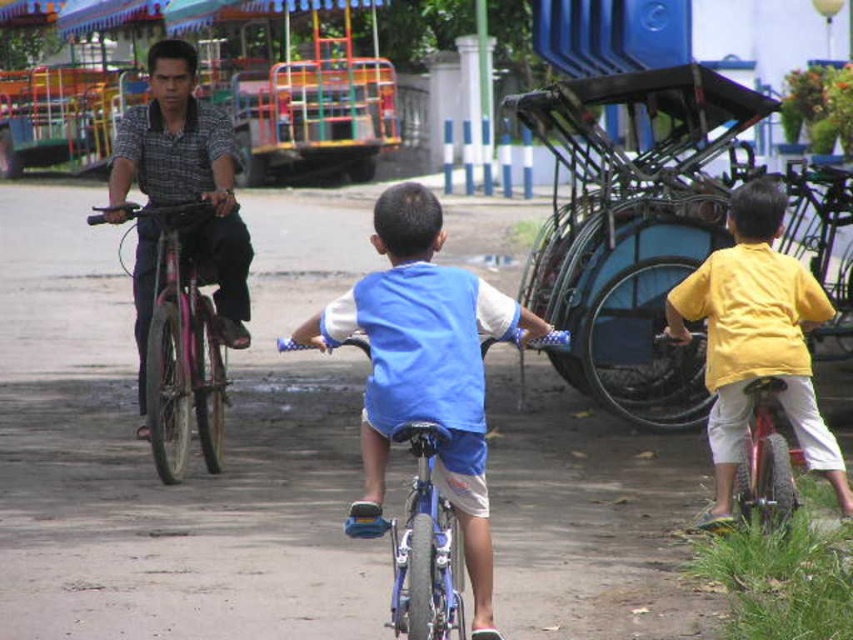
Question: Which point is farther to the camera?

Choices:
 (A) pink matte bicycle at left
 (B) yellow matte shirt at right

Answer: (A)

Question: Can you confirm if metallic blue tricycle at right is positioned to the left of blue fabric shirt at center?

Choices:
 (A) no
 (B) yes

Answer: (A)

Question: Which of the following is the closest to the observer?

Choices:
 (A) matte black shirt at left
 (B) metallic blue tricycle at right
 (C) blue fabric shirt at center
 (D) pink matte bicycle at left

Answer: (C)

Question: Does blue fabric shirt at center appear on the right side of pink matte bicycle at left?

Choices:
 (A) no
 (B) yes

Answer: (B)

Question: Which object is positioned closest to the metallic blue tricycle at right?

Choices:
 (A) yellow matte shirt at right
 (B) matte black shirt at left
 (C) pink matte bicycle at left
 (D) blue fabric shirt at center

Answer: (A)

Question: Can you confirm if blue fabric shirt at center is positioned above matte black shirt at left?

Choices:
 (A) yes
 (B) no

Answer: (B)